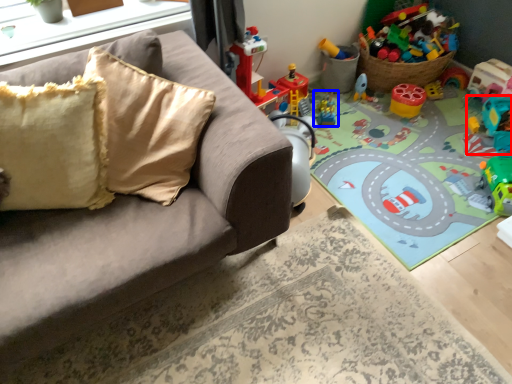
Question: Which object appears farthest to the camera in this image, toy (highlighted by a red box) or toy (highlighted by a blue box)?

Choices:
 (A) toy
 (B) toy

Answer: (B)